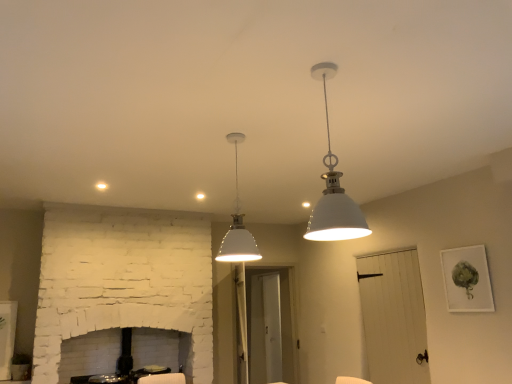
The width and height of the screenshot is (512, 384). Describe the element at coordinates (333, 190) in the screenshot. I see `white matte pendant light at upper center, the first lamp viewed from the front` at that location.

This screenshot has width=512, height=384. What are the coordinates of `matte white picture frame at upper right` in the screenshot? It's located at (467, 279).

Image resolution: width=512 pixels, height=384 pixels. Describe the element at coordinates (393, 317) in the screenshot. I see `white wood door at lower right` at that location.

Image resolution: width=512 pixels, height=384 pixels. I want to click on white matte pendant light at upper center, the first lamp viewed from the front, so click(x=333, y=190).

Based on the photo, between white wood door at lower right and matte white picture frame at upper right, which one has larger size?

Bigger between the two is white wood door at lower right.

From a real-world perspective, does white wood door at lower right sit lower than matte white picture frame at upper right?

Yes, from a real-world perspective, white wood door at lower right is under matte white picture frame at upper right.

Which is in front, point (411, 377) or point (477, 308)?

The point (477, 308) is closer.

Which object is more forward, white wood door at lower right or white matte pendant light at upper center, positioned as the second lamp in back-to-front order?

white matte pendant light at upper center, positioned as the second lamp in back-to-front order, is more forward.

From the picture: Is white wood door at lower right at the right side of white matte pendant light at upper center, the first lamp viewed from the front?

Yes, white wood door at lower right is to the right of white matte pendant light at upper center, the first lamp viewed from the front.

From a real-world perspective, is white wood door at lower right on white matte pendant light at upper center, the first lamp viewed from the front?

Incorrect, from a real-world perspective, white wood door at lower right is lower than white matte pendant light at upper center, the first lamp viewed from the front.

From the image's perspective, relative to white matte pendant light at upper center, which is the second lamp in left-to-right order, is white wood door at lower right above or below?

white wood door at lower right is situated lower than white matte pendant light at upper center, which is the second lamp in left-to-right order, in the image.

From a real-world perspective, who is located higher, white matte pendant light at center, which is counted as the 2th lamp, starting from the front, or white wood door at lower right?

white matte pendant light at center, which is counted as the 2th lamp, starting from the front.

Is white wood door at lower right at the back of white matte pendant light at center, which is the 1th lamp in left-to-right order?

No, white matte pendant light at center, which is the 1th lamp in left-to-right order,'s orientation is not away from white wood door at lower right.

Is white matte pendant light at center, which is the 1th lamp in left-to-right order, located outside white wood door at lower right?

Yes, white matte pendant light at center, which is the 1th lamp in left-to-right order, is located beyond the bounds of white wood door at lower right.

The height and width of the screenshot is (384, 512). Find the location of `picture frame below the white matte pendant light at upper center, positioned as the second lamp in back-to-front order (from the image's perspective)`. picture frame below the white matte pendant light at upper center, positioned as the second lamp in back-to-front order (from the image's perspective) is located at coordinates (467, 279).

From a real-world perspective, is matte white picture frame at upper right over white matte pendant light at upper center, positioned as the second lamp in back-to-front order?

No, from a real-world perspective, matte white picture frame at upper right is not on top of white matte pendant light at upper center, positioned as the second lamp in back-to-front order.

Does point (484, 293) come in front of point (323, 209)?

No, (484, 293) is further to viewer.

From the image's perspective, which one is positioned lower, white matte pendant light at upper center, the first lamp viewed from the front, or matte white picture frame at upper right?

From the image's view, matte white picture frame at upper right is below.

Which object is thinner, white matte pendant light at upper center, acting as the 1th lamp starting from the right, or matte white picture frame at upper right?

matte white picture frame at upper right.

From the image's perspective, starting from the matte white picture frame at upper right, which lamp is the 2nd one above? Please provide its 2D coordinates.

[(333, 190)]

Considering the relative sizes of white wood door at lower right and white matte pendant light at center, the second lamp in the right-to-left sequence, in the image provided, is white wood door at lower right wider than white matte pendant light at center, the second lamp in the right-to-left sequence,?

Incorrect, the width of white wood door at lower right does not surpass that of white matte pendant light at center, the second lamp in the right-to-left sequence.

From the picture: Which of these two, white wood door at lower right or white matte pendant light at center, which is the 1th lamp in left-to-right order, is smaller?

Smaller between the two is white matte pendant light at center, which is the 1th lamp in left-to-right order.

Considering the relative positions of white wood door at lower right and white matte pendant light at center, the second lamp in the right-to-left sequence, in the image provided, is white wood door at lower right to the left or to the right of white matte pendant light at center, the second lamp in the right-to-left sequence,?

white wood door at lower right is to the right of white matte pendant light at center, the second lamp in the right-to-left sequence.

Can you confirm if white wood door at lower right is shorter than white matte pendant light at center, the first lamp in the back-to-front sequence?

Incorrect, the height of white wood door at lower right does not fall short of that of white matte pendant light at center, the first lamp in the back-to-front sequence.

Does point (247, 232) come farther from viewer compared to point (483, 271)?

That is False.

From a real-world perspective, which object rests below the other?

matte white picture frame at upper right, from a real-world perspective.

Is white matte pendant light at center, which is the 1th lamp in left-to-right order, bigger than matte white picture frame at upper right?

Indeed, white matte pendant light at center, which is the 1th lamp in left-to-right order, has a larger size compared to matte white picture frame at upper right.

In the scene shown: Considering the positions of objects white matte pendant light at center, the second lamp in the right-to-left sequence, and matte white picture frame at upper right in the image provided, who is more to the right, white matte pendant light at center, the second lamp in the right-to-left sequence, or matte white picture frame at upper right?

From the viewer's perspective, matte white picture frame at upper right appears more on the right side.

Where is `picture frame in front of the white wood door at lower right`? The height and width of the screenshot is (384, 512). picture frame in front of the white wood door at lower right is located at coordinates 467,279.

Where is `the 1st lamp to the left of the white wood door at lower right, starting your count from the anchor`? the 1st lamp to the left of the white wood door at lower right, starting your count from the anchor is located at coordinates (333, 190).

When comparing their distances from white matte pendant light at upper center, positioned as the second lamp in back-to-front order, does white matte pendant light at center, which is the 1th lamp in left-to-right order, or white wood door at lower right seem closer?

Among the two, white matte pendant light at center, which is the 1th lamp in left-to-right order, is located nearer to white matte pendant light at upper center, positioned as the second lamp in back-to-front order.

Looking at the image, which one is located further to white matte pendant light at center, which is the 1th lamp in left-to-right order, matte white picture frame at upper right or white matte pendant light at upper center, positioned as the second lamp in back-to-front order?

matte white picture frame at upper right.

Looking at the image, which one is located further to white matte pendant light at center, the second lamp in the right-to-left sequence, matte white picture frame at upper right or white wood door at lower right?

Based on the image, white wood door at lower right appears to be further to white matte pendant light at center, the second lamp in the right-to-left sequence.

Based on the photo, considering their positions, is white matte pendant light at upper center, acting as the 1th lamp starting from the right, positioned further to white wood door at lower right than white matte pendant light at center, the first lamp in the back-to-front sequence?

Among the two, white matte pendant light at upper center, acting as the 1th lamp starting from the right, is located further to white wood door at lower right.

Looking at this image, looking at the image, which one is located further to white matte pendant light at center, which is the 1th lamp in left-to-right order, white wood door at lower right or matte white picture frame at upper right?

white wood door at lower right lies further to white matte pendant light at center, which is the 1th lamp in left-to-right order, than the other object.

Based on the photo, which object lies further to the anchor point white wood door at lower right, matte white picture frame at upper right or white matte pendant light at center, which is counted as the 2th lamp, starting from the front?

Among the two, white matte pendant light at center, which is counted as the 2th lamp, starting from the front, is located further to white wood door at lower right.

Looking at the image, which one is located closer to white matte pendant light at center, the first lamp in the back-to-front sequence, white matte pendant light at upper center, acting as the 1th lamp starting from the right, or matte white picture frame at upper right?

white matte pendant light at upper center, acting as the 1th lamp starting from the right, is positioned closer to the anchor white matte pendant light at center, the first lamp in the back-to-front sequence.

Looking at the image, which one is located closer to white matte pendant light at upper center, the first lamp viewed from the front, matte white picture frame at upper right or white wood door at lower right?

matte white picture frame at upper right lies closer to white matte pendant light at upper center, the first lamp viewed from the front, than the other object.

Find the location of a particular element. The height and width of the screenshot is (384, 512). lamp between white matte pendant light at center, the first lamp in the back-to-front sequence, and matte white picture frame at upper right from left to right is located at coordinates (333, 190).

Locate an element on the screen. The height and width of the screenshot is (384, 512). glass door between white matte pendant light at center, which is the 1th lamp in left-to-right order, and matte white picture frame at upper right, in the horizontal direction is located at coordinates (393, 317).

Find the location of a particular element. The image size is (512, 384). picture frame between white matte pendant light at upper center, positioned as the second lamp in back-to-front order, and white wood door at lower right in the front-back direction is located at coordinates (467, 279).

This screenshot has height=384, width=512. What are the coordinates of `lamp located between white matte pendant light at upper center, which is the second lamp in left-to-right order, and white wood door at lower right in the depth direction` in the screenshot? It's located at (237, 225).